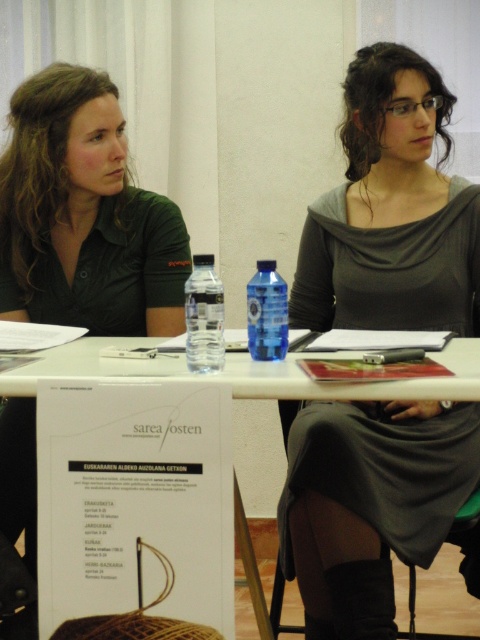
You are organizing a meeting and need to place a name tag on the table. The name tag is 10 cm wide. The gray matte dress at center and white paper at center are already on the table. Can the name tag fit between them without overlapping?

The gray matte dress at center is to the right of the white paper at center. Since the distance between them isn generated in the objects description, we cannot determine if the name tag will fit. Please check the actual distance between them.

Based on the photo, you are a fashion designer observing the scene. You need to determine which clothing item, the gray matte dress at center or the matte green polo shirt at left, would require more fabric to produce based on their sizes in the image. Which one would it be?

The gray matte dress at center is larger in size than the matte green polo shirt at left, so it would require more fabric to produce.